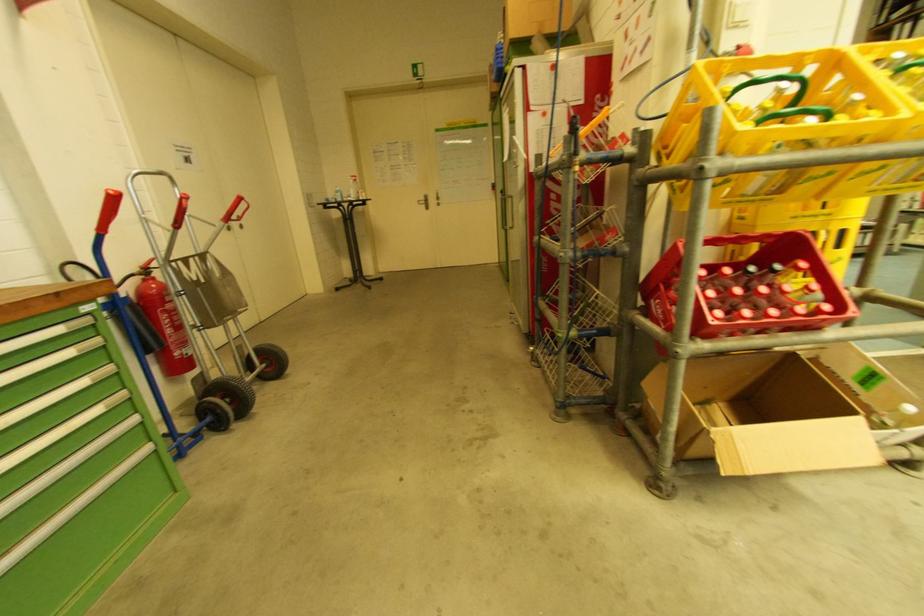
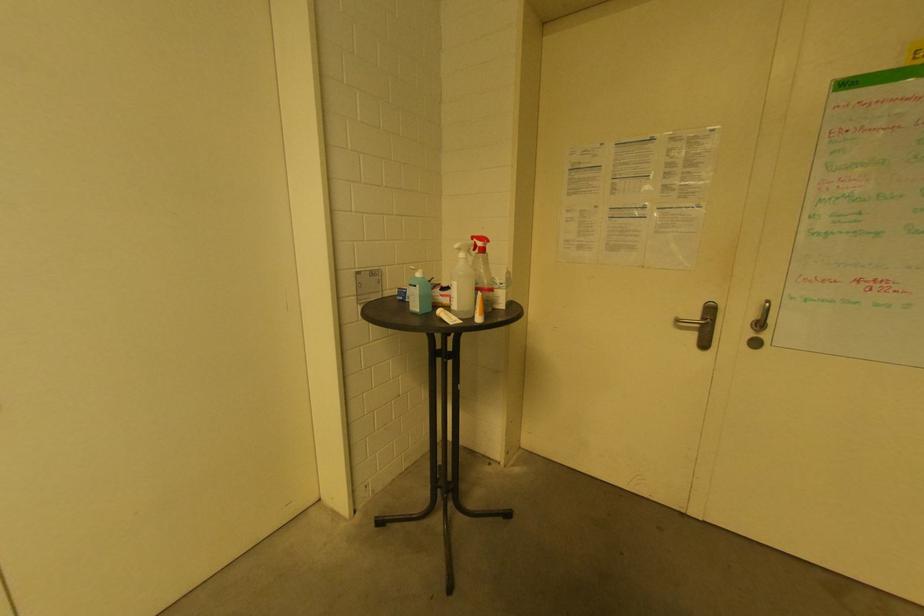
Where in the second image is the point corresponding to [357,180] from the first image?

(481, 245)